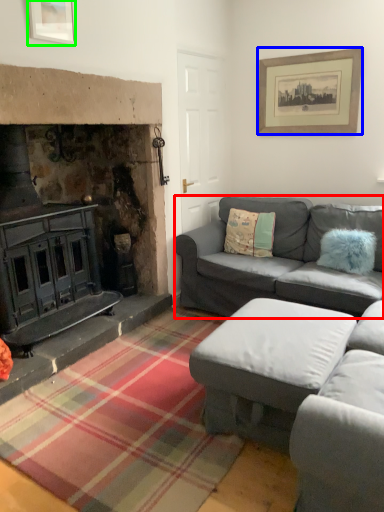
Question: Estimate the real-world distances between objects in this image. Which object is farther from studio couch (highlighted by a red box), picture frame (highlighted by a blue box) or picture frame (highlighted by a green box)?

Choices:
 (A) picture frame
 (B) picture frame

Answer: (B)